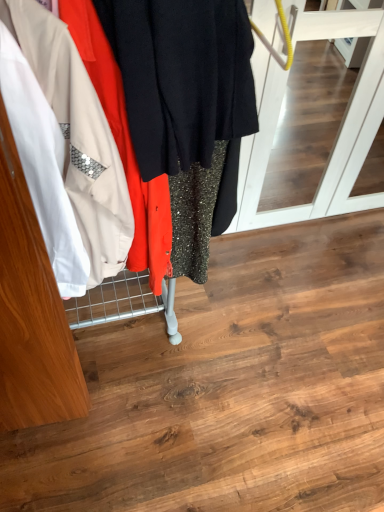
Find the location of a particular element. This screenshot has height=512, width=384. vacant space in front of matte black screen door at center is located at coordinates click(x=298, y=304).